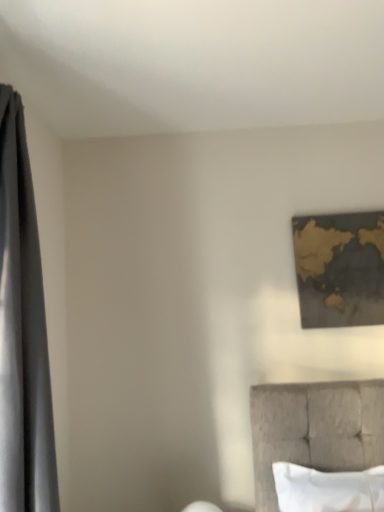
Question: Should I look upward or downward to see gold metallic map at upper right?

Choices:
 (A) up
 (B) down

Answer: (B)

Question: From a real-world perspective, is silky gray curtain at left located beneath white soft pillow at lower right?

Choices:
 (A) no
 (B) yes

Answer: (A)

Question: Is silky gray curtain at left positioned behind white soft pillow at lower right?

Choices:
 (A) yes
 (B) no

Answer: (B)

Question: From the image's perspective, does silky gray curtain at left appear lower than white soft pillow at lower right?

Choices:
 (A) yes
 (B) no

Answer: (B)

Question: Does silky gray curtain at left have a larger size compared to white soft pillow at lower right?

Choices:
 (A) yes
 (B) no

Answer: (A)

Question: Can you confirm if silky gray curtain at left is positioned to the right of white soft pillow at lower right?

Choices:
 (A) no
 (B) yes

Answer: (A)

Question: Is silky gray curtain at left shorter than white soft pillow at lower right?

Choices:
 (A) no
 (B) yes

Answer: (A)

Question: Can you confirm if silky gray curtain at left is taller than gold metallic map at upper right?

Choices:
 (A) yes
 (B) no

Answer: (A)

Question: Considering the relative positions of silky gray curtain at left and gold metallic map at upper right in the image provided, is silky gray curtain at left in front of gold metallic map at upper right?

Choices:
 (A) no
 (B) yes

Answer: (B)

Question: From a real-world perspective, is silky gray curtain at left physically above gold metallic map at upper right?

Choices:
 (A) no
 (B) yes

Answer: (A)

Question: From the image's perspective, is silky gray curtain at left below gold metallic map at upper right?

Choices:
 (A) yes
 (B) no

Answer: (A)

Question: Considering the relative sizes of silky gray curtain at left and gold metallic map at upper right in the image provided, is silky gray curtain at left shorter than gold metallic map at upper right?

Choices:
 (A) no
 (B) yes

Answer: (A)

Question: Could you tell me if silky gray curtain at left is turned towards gold metallic map at upper right?

Choices:
 (A) no
 (B) yes

Answer: (A)

Question: Considering the relative positions of gold metallic map at upper right and silky gray curtain at left in the image provided, is gold metallic map at upper right to the right of silky gray curtain at left from the viewer's perspective?

Choices:
 (A) yes
 (B) no

Answer: (A)